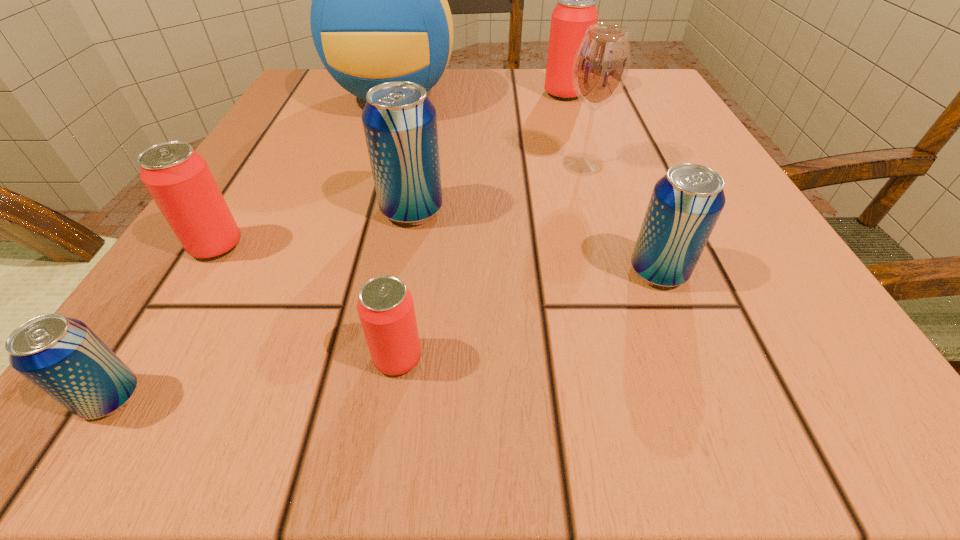
You are a GUI agent. You are given a task and a screenshot of the screen. Output one action in this format:
    pyautogui.click(x=<x>, y=<y>)
    Task: Click on the vacant space at the far edge of the desktop
    The image size is (960, 540).
    Given the screenshot: What is the action you would take?
    pyautogui.click(x=540, y=73)

This screenshot has height=540, width=960. What are the coordinates of `vacant space at the left edge of the desktop` in the screenshot? It's located at (270, 131).

I want to click on vacant space at the right edge of the desktop, so click(x=638, y=206).

Find the location of a particular element. This screenshot has width=960, height=540. vacant position at the far left corner of the desktop is located at coordinates (365, 102).

In the image, there is a desktop. Identify the location of free region at the near right corner. (694, 376).

Locate an element on the screen. This screenshot has height=540, width=960. free space between the second blue beer can from right to left and the third farthest object is located at coordinates (497, 187).

In order to click on free space between the blue volleyball and the wineglass in this screenshot , I will do `click(489, 131)`.

At what (x,y) coordinates should I click in order to perform the action: click on vacant space that is in between the wineglass and the second red beer can from left to right. Please return your answer as a coordinate pair (x, y). Looking at the image, I should click on (491, 261).

Identify the location of free area in between the farthest blue beer can and the second smallest blue beer can. This screenshot has height=540, width=960. (535, 241).

Image resolution: width=960 pixels, height=540 pixels. Identify the location of free spot between the nearest red beer can and the farthest red beer can. (481, 226).